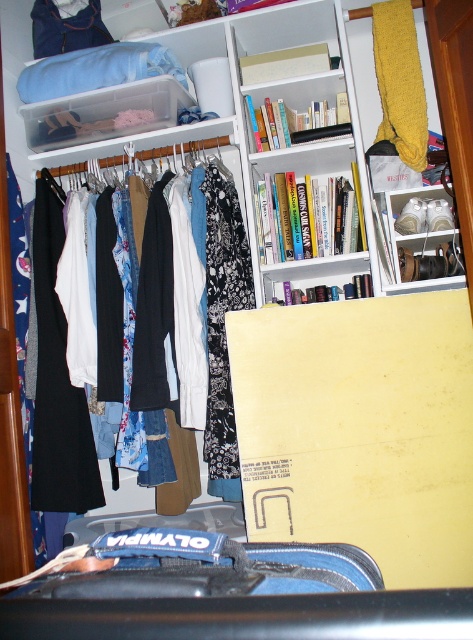
You are organizing the closet and want to place the white cotton shirt at center on top of the hardcover books at upper center. Based on their sizes, will the shirt fit without hanging over the edge?

The white cotton shirt at center is taller than the hardcover books at upper center, so placing it on top would cause it to hang over the edge since it is taller.

You are organizing the closet and notice the black floral fabric at center and the hardcover books at upper center. Which item is positioned to the right side?

The hardcover books at upper center are positioned to the right of the black floral fabric at center.